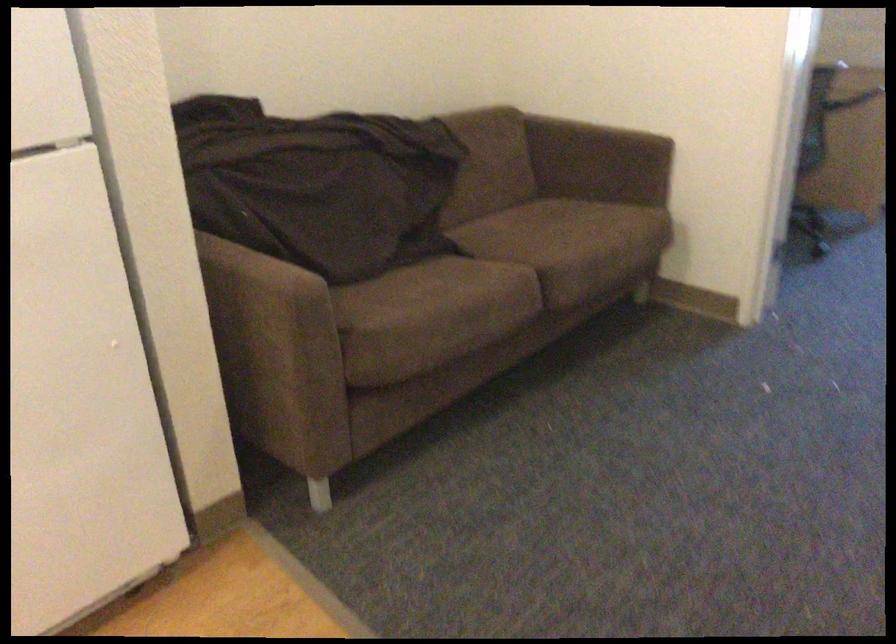
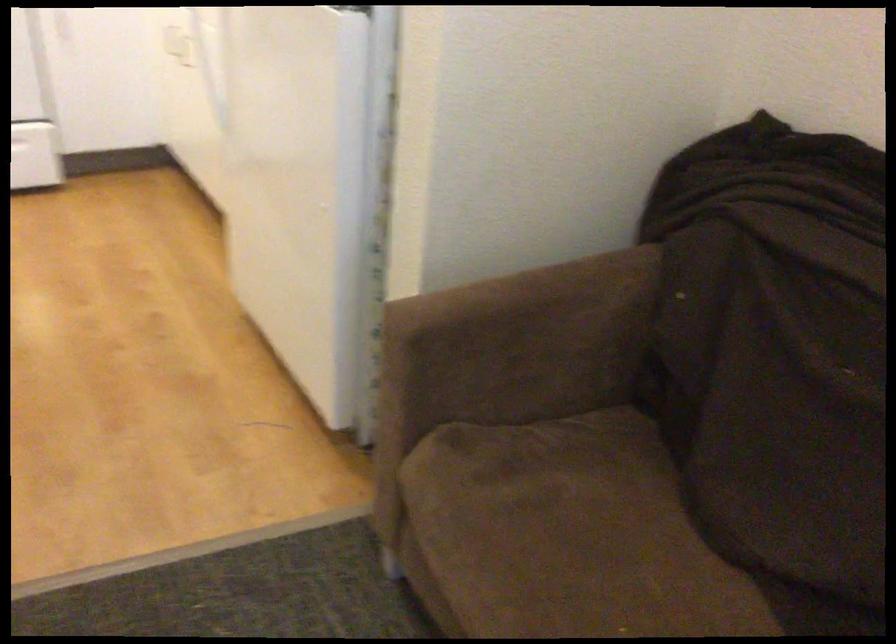
Locate, in the second image, the point that corresponds to pixel 398 305 in the first image.

(563, 542)